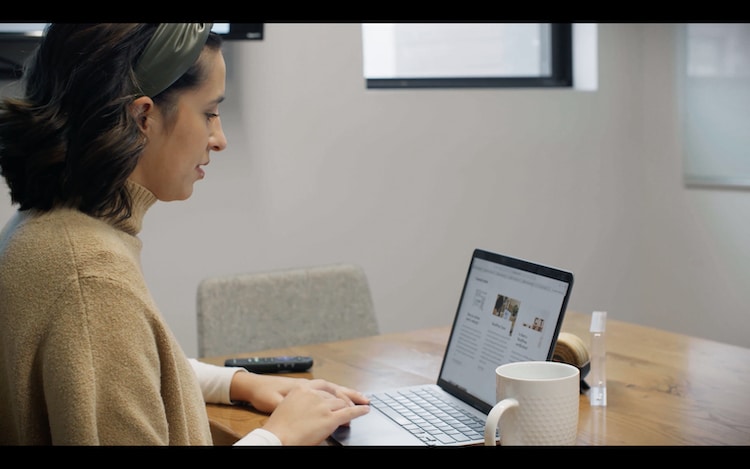
Where is `screen`? This screenshot has width=750, height=469. screen is located at coordinates (492, 316).